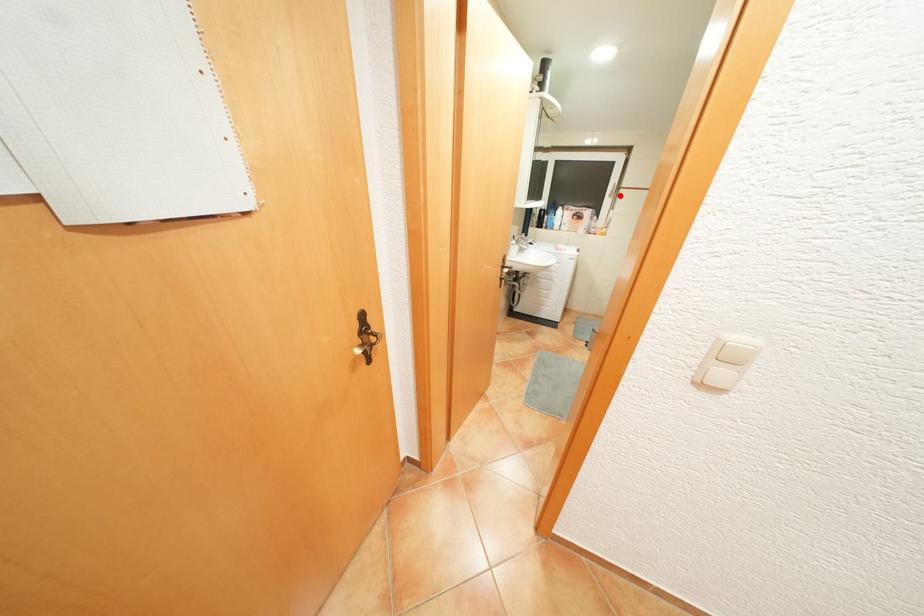
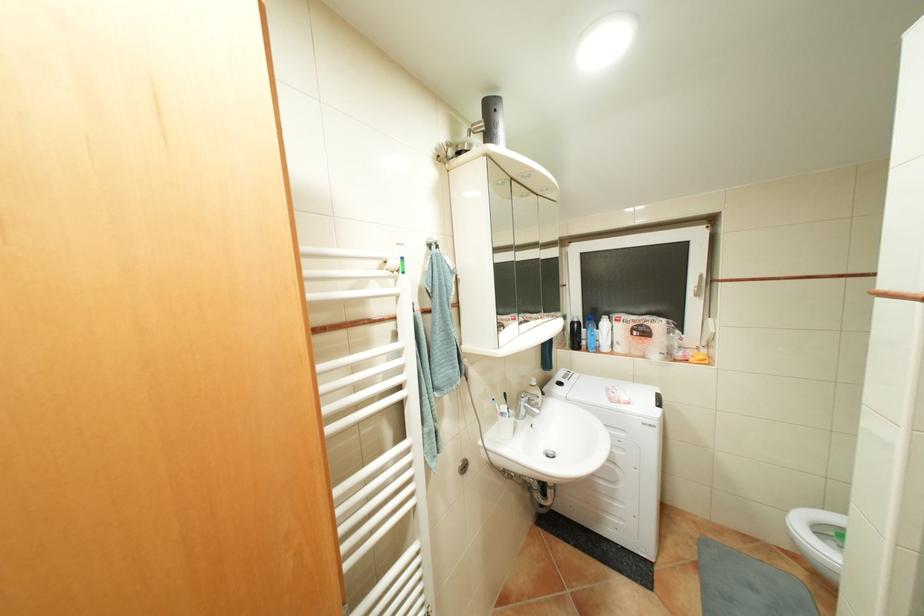
In the second image, find the point that corresponds to the highlighted location in the first image.

(707, 294)